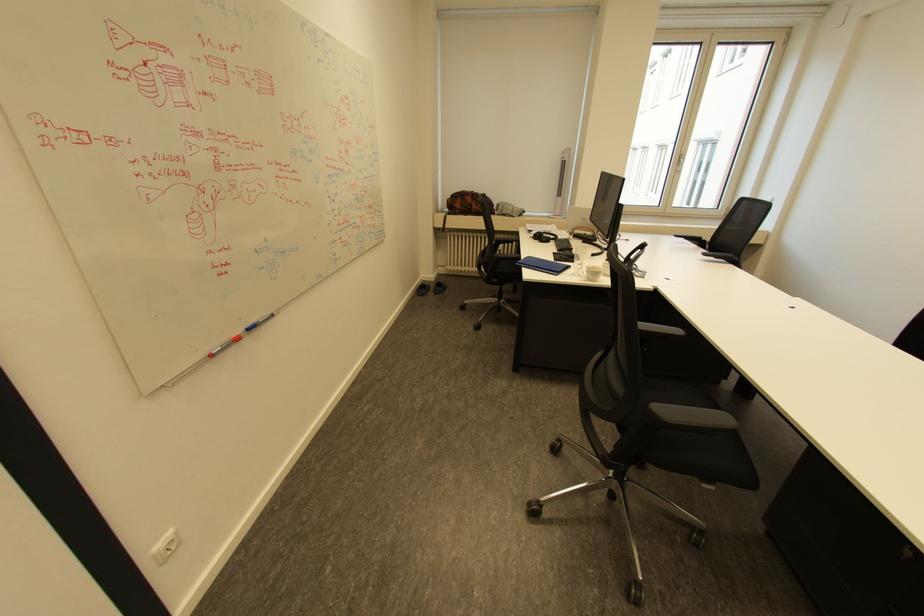
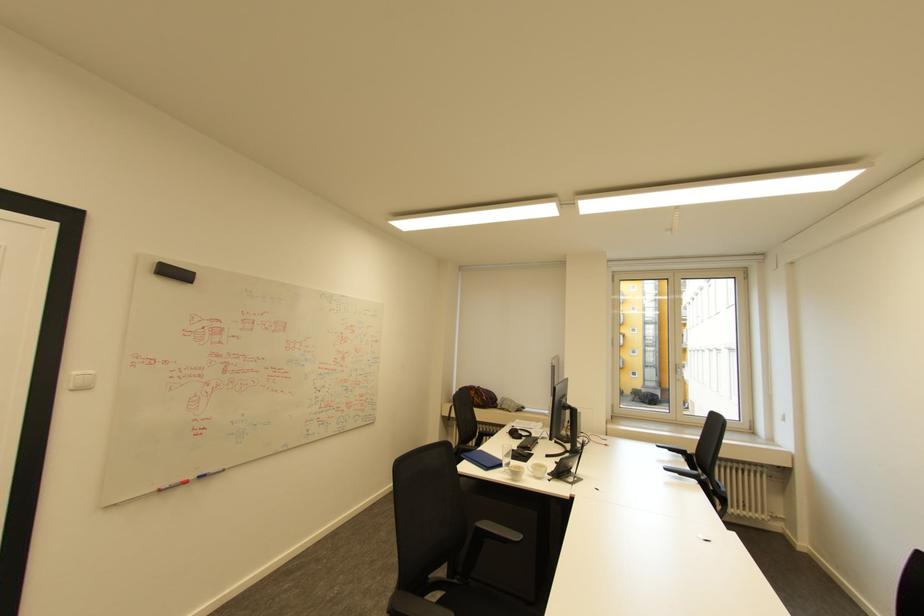
In the second image, find the point that corresponds to point (552, 235) in the first image.

(526, 432)